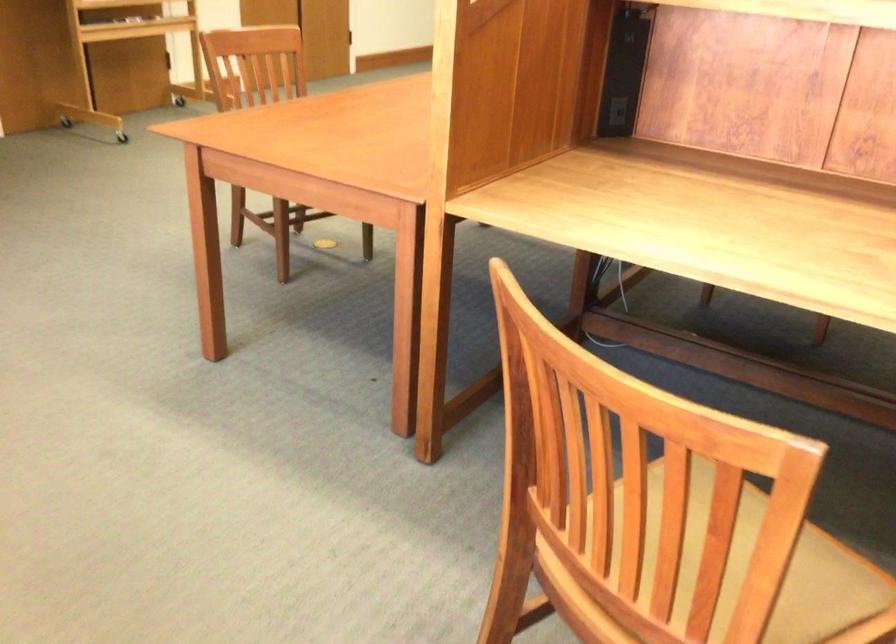
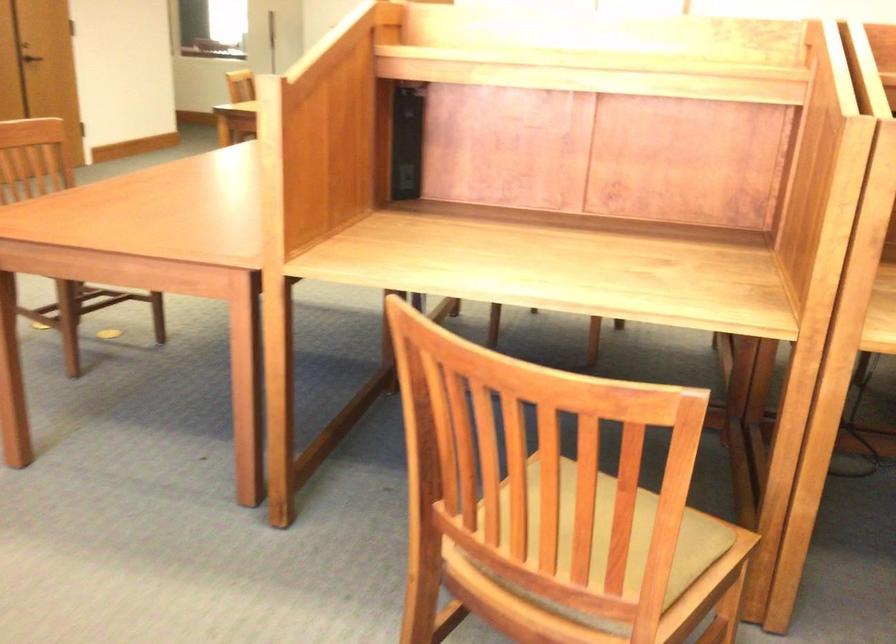
What movement of the cameraman would produce the second image?

The cameraman walked toward left, backward.